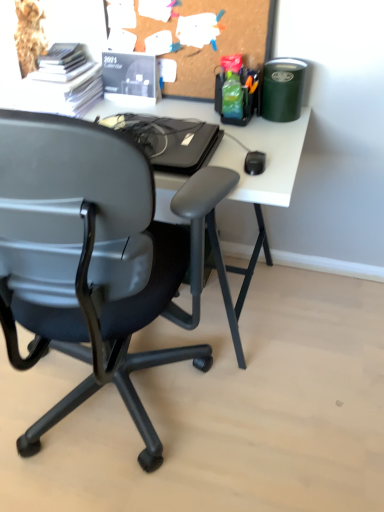
You are a GUI agent. You are given a task and a screenshot of the screen. Output one action in this format:
    pyautogui.click(x=<x>, y=<y>)
    Task: Click on the free space in front of translucent plastic organizer at upper right, acting as the second stationery starting from the right
    Image resolution: width=384 pixels, height=512 pixels.
    Given the screenshot: What is the action you would take?
    pyautogui.click(x=258, y=132)